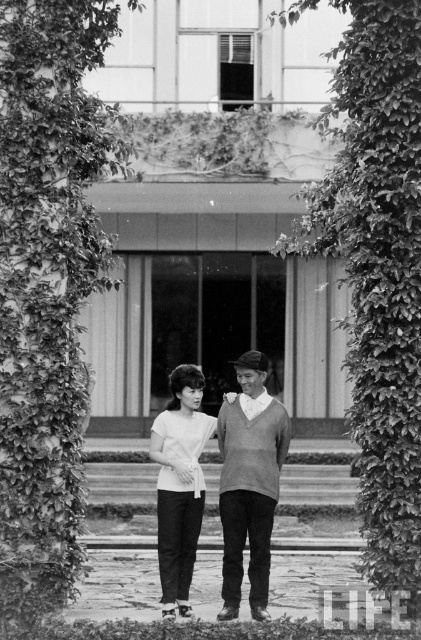
Question: Can you confirm if green leafy ivy at left is smaller than white matte shirt at center?

Choices:
 (A) no
 (B) yes

Answer: (A)

Question: Based on their relative distances, which object is farther from the green leafy ivy at left?

Choices:
 (A) white matte shirt at center
 (B) sweater-knit sweater at center

Answer: (B)

Question: Where is green leafy ivy at left located in relation to green leafy ivy at center in the image?

Choices:
 (A) left
 (B) right

Answer: (A)

Question: Estimate the real-world distances between objects in this image. Which object is closer to the white matte shirt at center?

Choices:
 (A) sweater-knit sweater at center
 (B) green leafy ivy at center

Answer: (A)

Question: Which object is positioned farthest from the sweater-knit sweater at center?

Choices:
 (A) white matte shirt at center
 (B) green leafy ivy at center
 (C) green leafy ivy at left

Answer: (C)

Question: Can you confirm if green leafy ivy at center is wider than sweater-knit sweater at center?

Choices:
 (A) no
 (B) yes

Answer: (A)